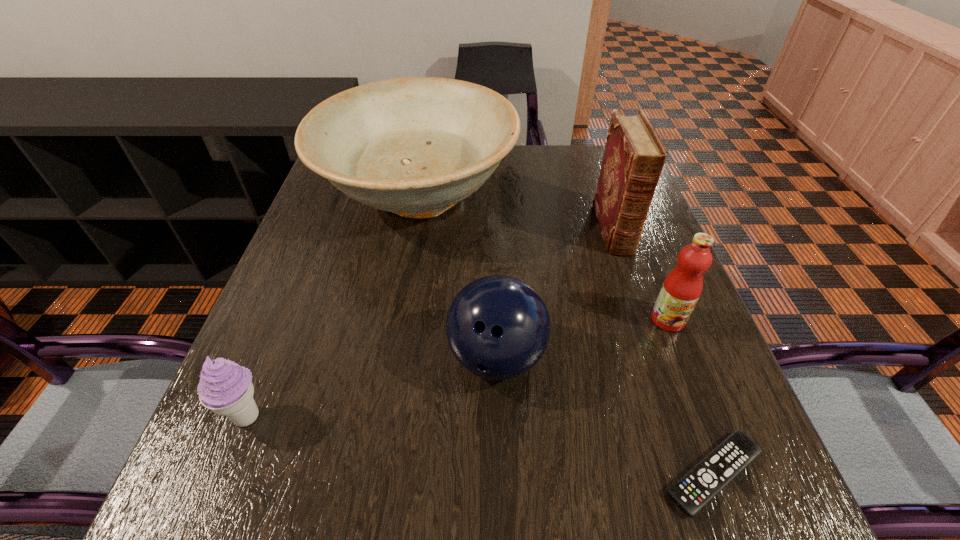
The width and height of the screenshot is (960, 540). In order to click on hardback book in this screenshot , I will do `click(634, 156)`.

The height and width of the screenshot is (540, 960). Find the location of `dish`. dish is located at coordinates (416, 146).

The image size is (960, 540). I want to click on fruit juice, so click(x=681, y=289).

You are a GUI agent. You are given a task and a screenshot of the screen. Output one action in this format:
    pyautogui.click(x=<x>, y=<y>)
    Task: Click on the bowling ball
    Image resolution: width=960 pixels, height=540 pixels.
    Given the screenshot: What is the action you would take?
    pyautogui.click(x=498, y=327)

The image size is (960, 540). I want to click on icecream, so click(226, 388).

Locate an element on the screen. This screenshot has width=960, height=540. remote control is located at coordinates (705, 480).

Locate an element on the screen. Image resolution: width=960 pixels, height=540 pixels. vacant space positioned on the spine side of the hardback book is located at coordinates (655, 350).

At what (x,y) coordinates should I click in order to perform the action: click on vacant space located 0.250m on the right of the dish. Please return your answer as a coordinate pair (x, y). Looking at the image, I should click on (609, 197).

Where is `vacant space situated 0.150m on the front label of the fruit juice`? The width and height of the screenshot is (960, 540). vacant space situated 0.150m on the front label of the fruit juice is located at coordinates (700, 402).

Where is `blank space located 0.060m on the surface of the bowling ball near the finger holes`? The width and height of the screenshot is (960, 540). blank space located 0.060m on the surface of the bowling ball near the finger holes is located at coordinates (499, 434).